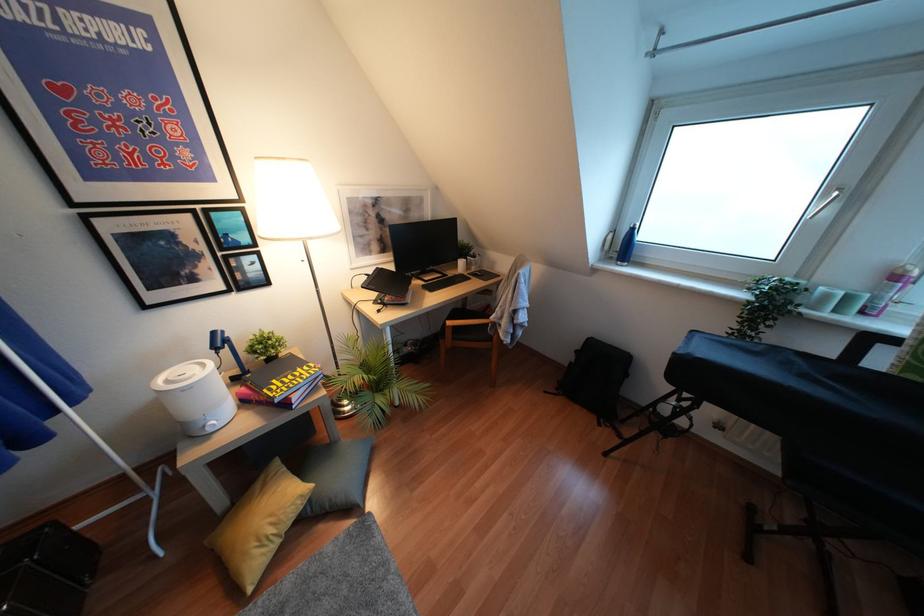
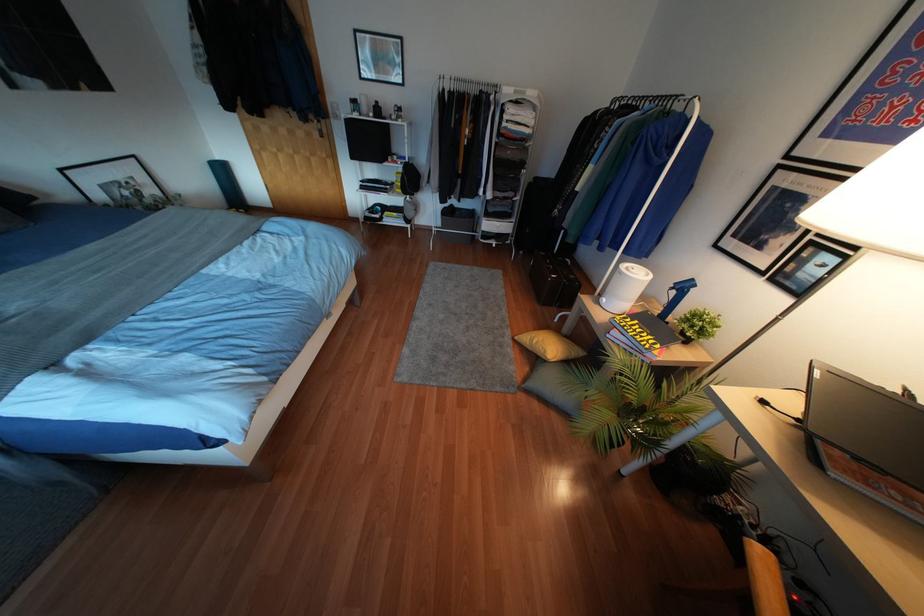
Where in the second image is the point corresponding to pixel 273 381 from the first image?

(637, 321)